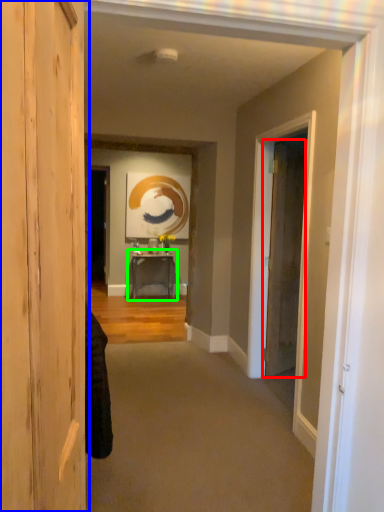
Question: Which is nearer to the door (highlighted by a red box)? door (highlighted by a blue box) or table (highlighted by a green box).

Choices:
 (A) door
 (B) table

Answer: (B)